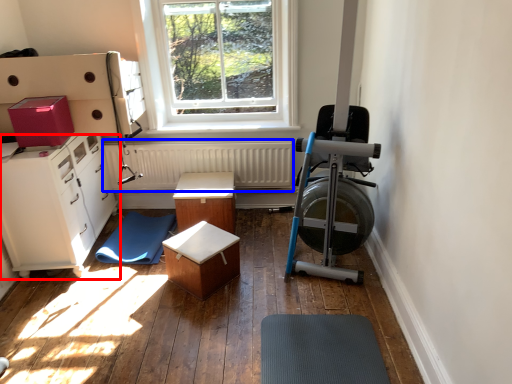
Question: Which point is closer to the camera, cabinetry (highlighted by a red box) or radiator (highlighted by a blue box)?

Choices:
 (A) cabinetry
 (B) radiator

Answer: (A)